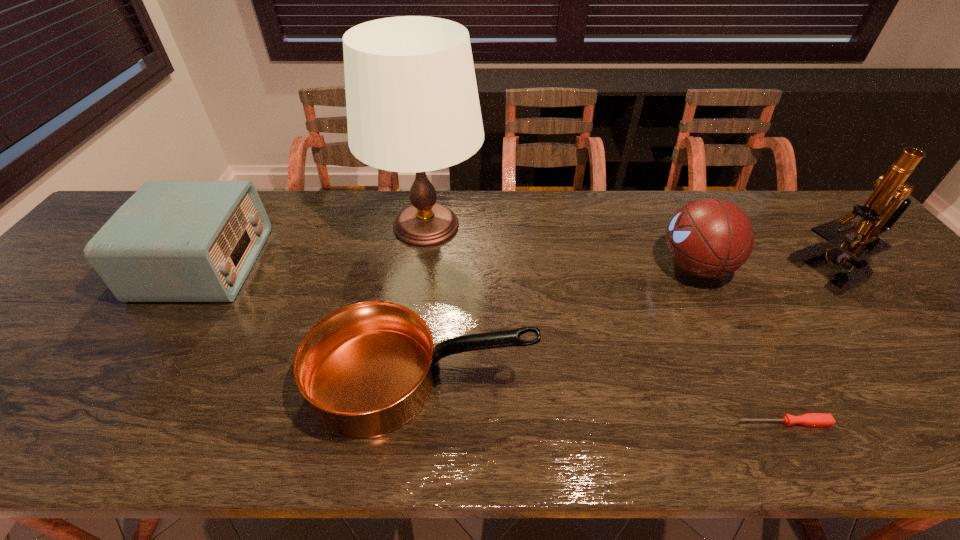
What are the coordinates of `screwdriver that is at the near edge` in the screenshot? It's located at (809, 419).

Find the location of a particular element. This screenshot has height=540, width=960. object situated at the right edge is located at coordinates (887, 203).

Identify the location of vacant space at the far edge of the desktop. (388, 193).

In the image, there is a desktop. Where is `blank space at the near edge`? This screenshot has width=960, height=540. blank space at the near edge is located at coordinates (113, 429).

This screenshot has height=540, width=960. In order to click on free space at the left edge of the desktop in this screenshot , I will do `click(83, 319)`.

I want to click on free spot at the far right corner of the desktop, so click(834, 217).

What are the coordinates of `blank region between the frying pan and the screwdriver` in the screenshot? It's located at (603, 402).

Find the location of a particular element. Image resolution: width=960 pixels, height=540 pixels. free area in between the frying pan and the lamp is located at coordinates (424, 303).

You are a GUI agent. You are given a task and a screenshot of the screen. Output one action in this format:
    pyautogui.click(x=<x>, y=<y>)
    Task: Click on the free space between the microscope and the basketball
    
    Given the screenshot: What is the action you would take?
    pyautogui.click(x=766, y=269)

Identify the location of free spot between the tallest object and the frying pan. The width and height of the screenshot is (960, 540). (424, 303).